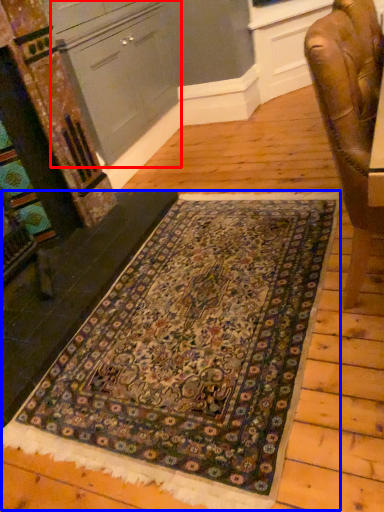
Question: Which point is closer to the camera, cabinetry (highlighted by a red box) or mat (highlighted by a blue box)?

Choices:
 (A) cabinetry
 (B) mat

Answer: (B)